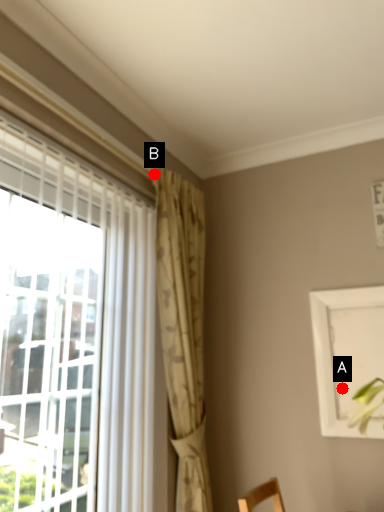
Question: Two points are circled on the image, labeled by A and B beside each circle. Which of the following is the farthest from the observer?

Choices:
 (A) A is further
 (B) B is further

Answer: (B)